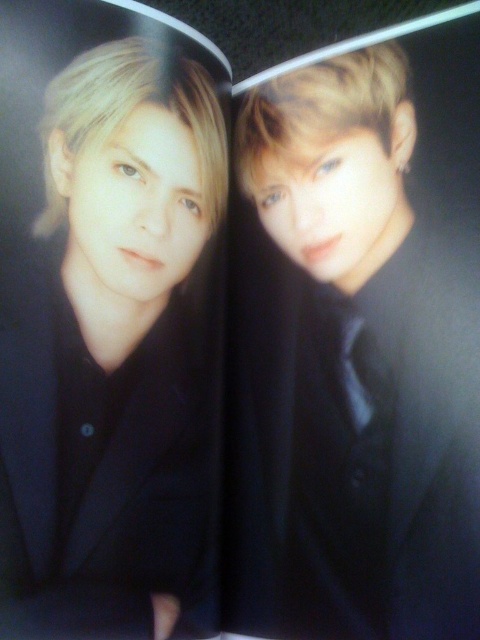
You are holding a small 12 inch ruler and want to measure the distance between the point at coordinates point [51,332] and yourself. Can you determine if the ruler will be sufficient to measure this distance?

The distance between point [51,332] and the viewer is 24.83 inches. Since the ruler is only 12 inches long, it is not long enough to measure the distance. You will need a longer measuring tool.

You are a fashion designer observing two outfits in the image. You need to decide which one is taller between the matte black jacket at left and the black satin business suit at center. Which one is taller?

The matte black jacket at left has a greater height compared to the black satin business suit at center, so the matte black jacket at left is taller.

You are a fashion designer who wants to create a new collection with two outfits. You have two options from the image provided. The first is the matte black jacket at left, and the second is the black satin business suit at center. Which outfit takes up less horizontal space?

The matte black jacket at left has a smaller width than the black satin business suit at center, so it takes up less horizontal space.